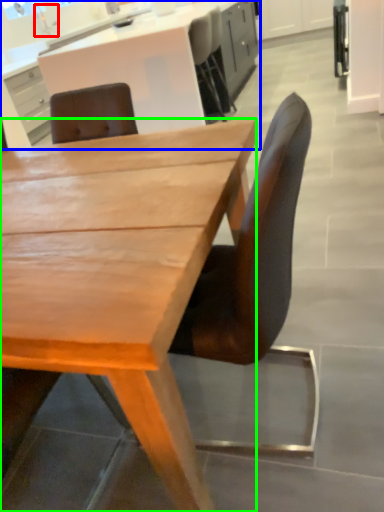
Question: Considering the real-world distances, which object is closest to faucet (highlighted by a red box)? cabinetry (highlighted by a blue box) or desk (highlighted by a green box).

Choices:
 (A) cabinetry
 (B) desk

Answer: (A)